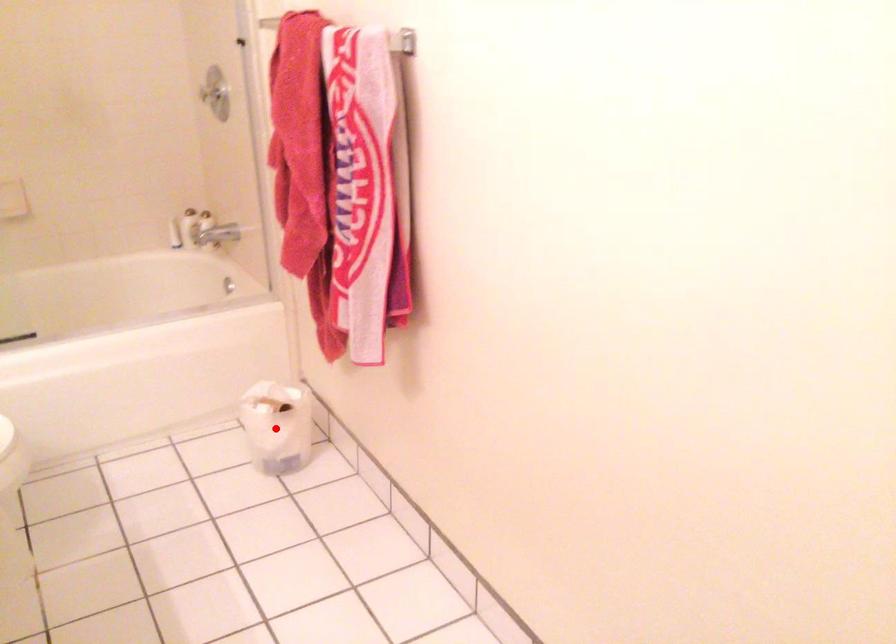
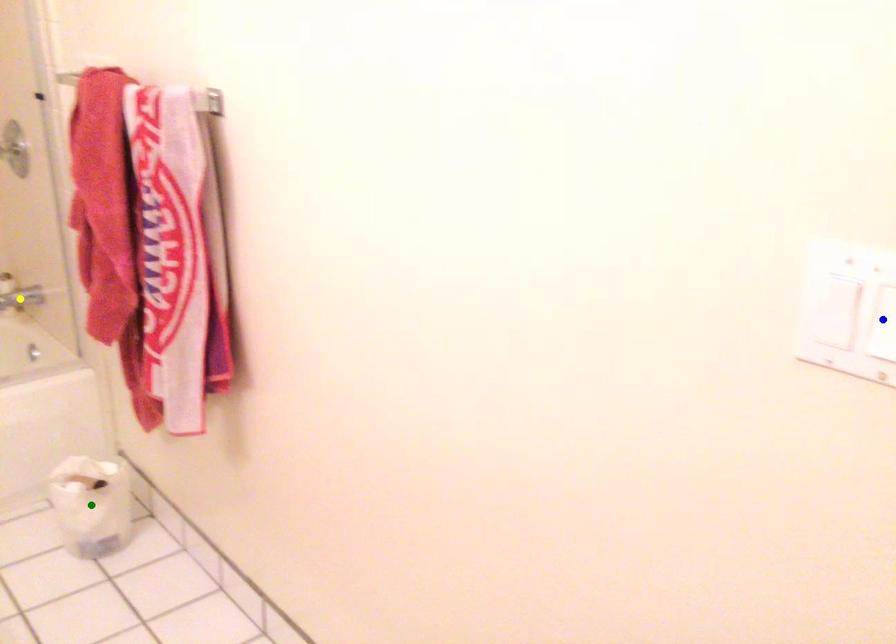
Question: I am providing you with two images of the same scene from different viewpoints. A red point is marked on the first image. You are given multiple points on the second image. In image 2, which mark is for the same physical point as the one in image 1?

Choices:
 (A) yellow point
 (B) blue point
 (C) green point

Answer: (C)